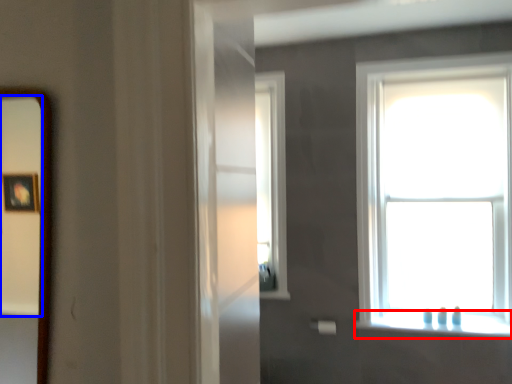
Question: Which point is closer to the camera, window sill (highlighted by a red box) or mirror (highlighted by a blue box)?

Choices:
 (A) window sill
 (B) mirror

Answer: (B)